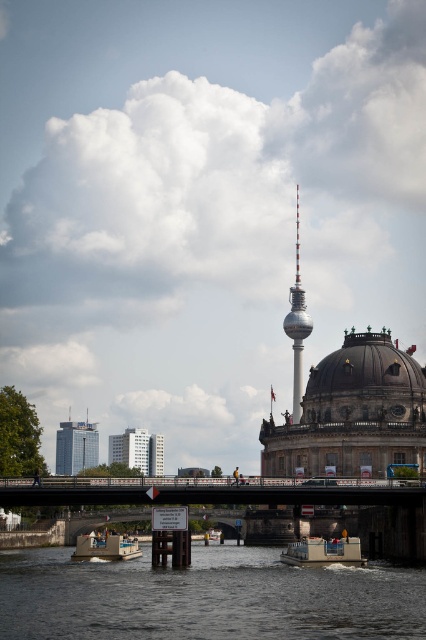
Question: Estimate the real-world distances between objects in this image. Which object is farther from the matte gray dome at center?

Choices:
 (A) wooden boat at center
 (B) white plastic boat at lower center
 (C) dark gray water at lower center

Answer: (A)

Question: Does glassy steel skyscraper at left appear over white glass building at center?

Choices:
 (A) yes
 (B) no

Answer: (A)

Question: Which object is positioned closest to the metallic gray bridge at center?

Choices:
 (A) wooden boat at center
 (B) glassy steel skyscraper at left
 (C) silver metallic tower at center

Answer: (A)

Question: Is white glass building at center to the right of white plastic boat at lower center from the viewer's perspective?

Choices:
 (A) yes
 (B) no

Answer: (B)

Question: Considering the real-world distances, which object is farthest from the glassy steel skyscraper at left?

Choices:
 (A) silver metallic tower at center
 (B) wooden boat at center
 (C) white plastic boat at lower center

Answer: (C)

Question: Can you confirm if matte gray dome at center is positioned above silver metallic tower at center?

Choices:
 (A) yes
 (B) no

Answer: (B)